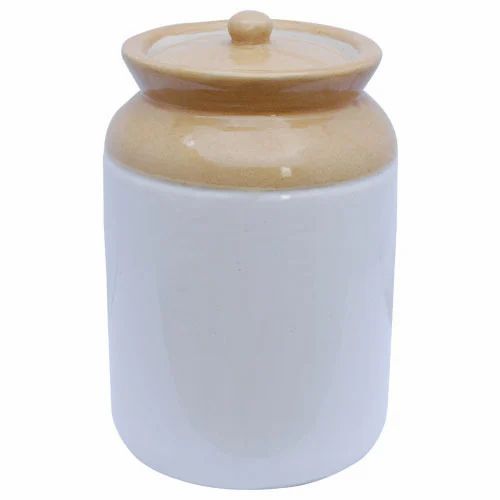
I want to click on jar, so click(240, 355).